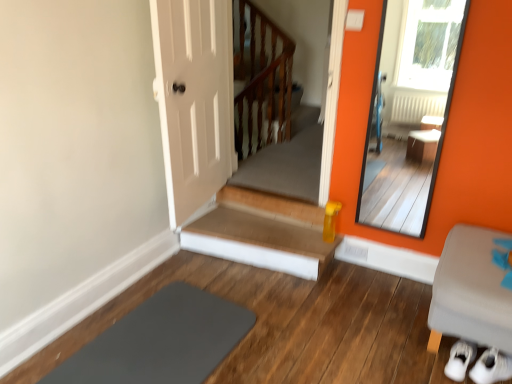
Question: From a real-world perspective, relative to wooden stairs at center, is smooth orange mirror at right vertically above or below?

Choices:
 (A) above
 (B) below

Answer: (A)

Question: Looking at their shapes, would you say smooth orange mirror at right is wider or thinner than wooden stairs at center?

Choices:
 (A) wide
 (B) thin

Answer: (B)

Question: Considering the real-world distances, which object is farthest from the wooden at upper center?

Choices:
 (A) wooden stairs at center
 (B) smooth orange mirror at right
 (C) slate at lower left
 (D) gray fabric ottoman at lower right

Answer: (D)

Question: Which is nearer to the wooden stairs at center?

Choices:
 (A) wooden at upper center
 (B) slate at lower left
 (C) smooth orange mirror at right
 (D) gray fabric ottoman at lower right

Answer: (B)